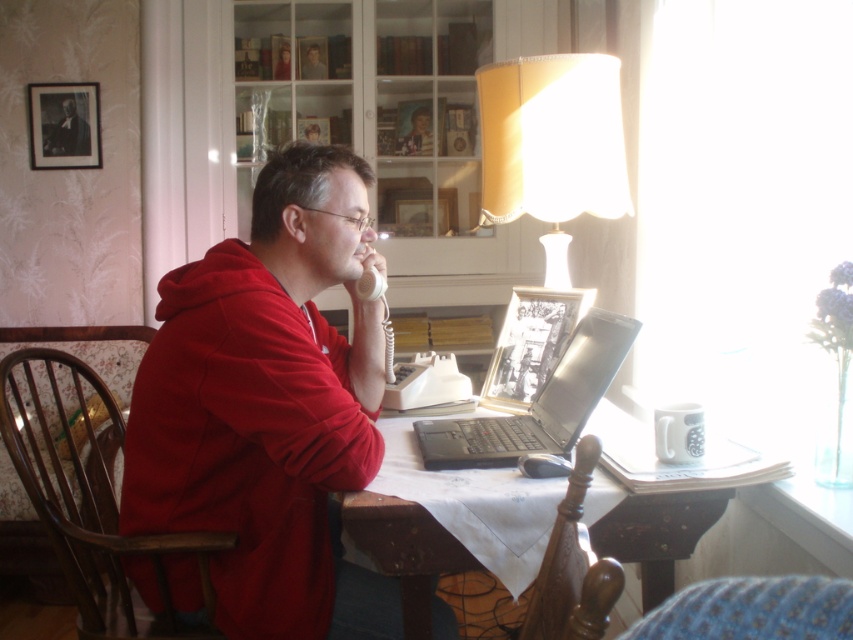
Is point (285, 340) closer to camera compared to point (352, 547)?

Yes.

Between matte red hoodie at center and white cloth-covered table at center, which one has more height?

matte red hoodie at center is taller.

Where is `matte red hoodie at center`? matte red hoodie at center is located at coordinates (270, 406).

From the picture: Is yellow fabric lampshade at upper right above smooth skin face at upper center?

No.

Is yellow fabric lampshade at upper right taller than smooth skin face at upper center?

Correct, yellow fabric lampshade at upper right is much taller as smooth skin face at upper center.

Which is behind, point (585, 86) or point (305, 68)?

The point (305, 68) is more distant.

The height and width of the screenshot is (640, 853). Find the location of `yellow fabric lampshade at upper right`. yellow fabric lampshade at upper right is located at coordinates point(552,145).

Is matte red hoodie at center further to camera compared to silver metallic laptop at center?

No, it is in front of silver metallic laptop at center.

You are a GUI agent. You are given a task and a screenshot of the screen. Output one action in this format:
    pyautogui.click(x=<x>, y=<y>)
    Task: Click on the matte red hoodie at center
    
    Given the screenshot: What is the action you would take?
    pyautogui.click(x=270, y=406)